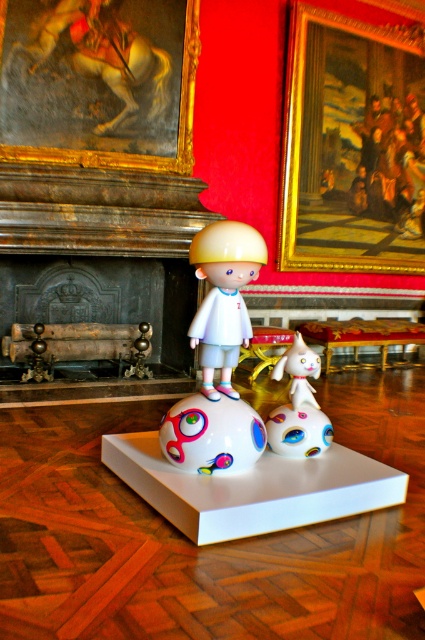
Question: Estimate the real-world distances between objects in this image. Which object is closer to the matte white ball at center?

Choices:
 (A) white glossy cat at center
 (B) matte white doll at center

Answer: (B)

Question: Does matte white doll at center appear over multicolored glossy ball at center?

Choices:
 (A) yes
 (B) no

Answer: (A)

Question: Does matte white doll at center appear on the left side of white glossy cat at center?

Choices:
 (A) no
 (B) yes

Answer: (B)

Question: Which object is closer to the camera taking this photo?

Choices:
 (A) white glossy cat at center
 (B) matte white doll at center
 (C) matte white ball at center

Answer: (B)

Question: Estimate the real-world distances between objects in this image. Which object is farther from the multicolored glossy ball at center?

Choices:
 (A) matte white ball at center
 (B) matte white doll at center

Answer: (B)

Question: In this image, where is matte white ball at center located relative to white glossy cat at center?

Choices:
 (A) below
 (B) above

Answer: (A)